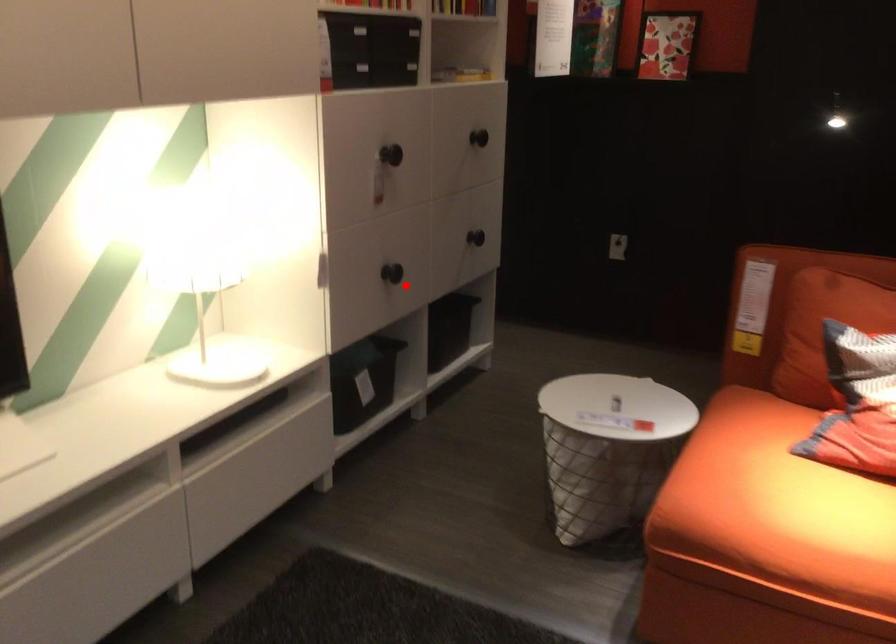
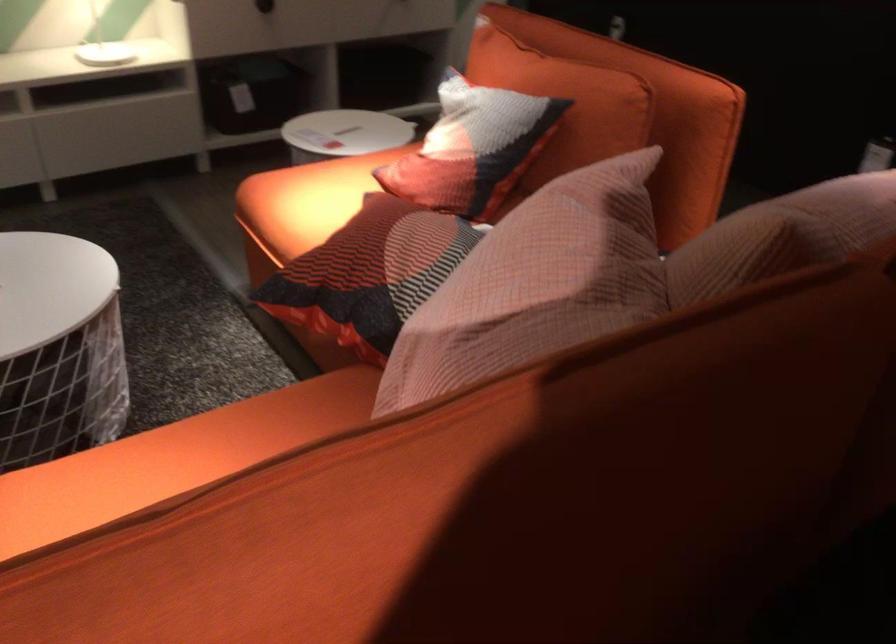
Where in the second image is the point corresponding to the highlighted location from the first image?

(264, 6)